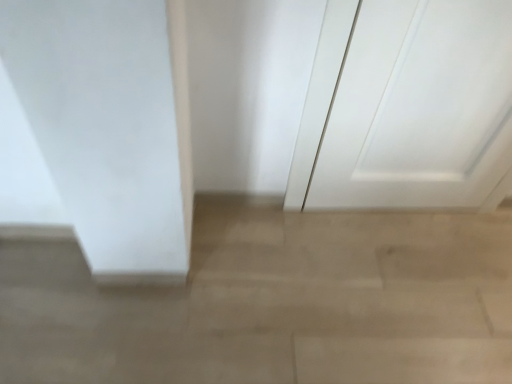
Locate an element on the screen. This screenshot has width=512, height=384. white matte door at upper right is located at coordinates (407, 108).

What is the approximate height of white matte door at upper right?

white matte door at upper right is 87.84 centimeters tall.

Image resolution: width=512 pixels, height=384 pixels. Describe the element at coordinates (407, 108) in the screenshot. I see `white matte door at upper right` at that location.

Measure the distance between point (x=465, y=59) and camera.

They are 3.83 feet apart.

Locate an element on the screen. The image size is (512, 384). beige polished concrete at center is located at coordinates (274, 303).

This screenshot has height=384, width=512. What do you see at coordinates (274, 303) in the screenshot? I see `beige polished concrete at center` at bounding box center [274, 303].

In order to face beige polished concrete at center, should I rotate leftwards or rightwards?

Rotate right and turn 3.990 degrees.

Image resolution: width=512 pixels, height=384 pixels. Identify the location of white matte door at upper right. (407, 108).

Is beige polished concrete at center to the left of white matte door at upper right from the viewer's perspective?

Yes.

Is beige polished concrete at center in front of or behind white matte door at upper right in the image?

beige polished concrete at center is behind white matte door at upper right.

Does point (61, 248) appear closer or farther from the camera than point (407, 159)?

Point (61, 248) appears to be closer to the viewer than point (407, 159).

From the image's perspective, is beige polished concrete at center on top of white matte door at upper right?

No.

From a real-world perspective, which object rests below the other?

beige polished concrete at center is physically lower.

Is beige polished concrete at center wider or thinner than white matte door at upper right?

In the image, beige polished concrete at center appears to be wider than white matte door at upper right.

Looking at this image, is beige polished concrete at center taller or shorter than white matte door at upper right?

beige polished concrete at center is shorter than white matte door at upper right.

Does beige polished concrete at center have a smaller size compared to white matte door at upper right?

No, beige polished concrete at center is not smaller than white matte door at upper right.

In the scene shown: Which is correct: beige polished concrete at center is inside white matte door at upper right, or outside of it?

beige polished concrete at center is not enclosed by white matte door at upper right.

Is beige polished concrete at center directly adjacent to white matte door at upper right?

No, beige polished concrete at center is not next to white matte door at upper right.

Is beige polished concrete at center aimed at white matte door at upper right?

No.

Based on the photo, what's the angular difference between beige polished concrete at center and white matte door at upper right's facing directions?

They differ by 91.4 degrees in their facing directions.

At what (x,y) coordinates should I click in order to perform the action: click on concrete that appears below the white matte door at upper right (from a real-world perspective). Please return your answer as a coordinate pair (x, y). This screenshot has height=384, width=512. Looking at the image, I should click on (274, 303).

Does white matte door at upper right appear on the left side of beige polished concrete at center?

No, white matte door at upper right is not to the left of beige polished concrete at center.

Is white matte door at upper right further to camera compared to beige polished concrete at center?

No, the depth of white matte door at upper right is less than that of beige polished concrete at center.

Does point (485, 127) come farther from viewer compared to point (126, 298)?

Yes, it is behind point (126, 298).

From the image's perspective, would you say white matte door at upper right is shown under beige polished concrete at center?

No.

From a real-world perspective, between white matte door at upper right and beige polished concrete at center, who is vertically higher?

white matte door at upper right, from a real-world perspective.

Which of these two, white matte door at upper right or beige polished concrete at center, is thinner?

Thinner between the two is white matte door at upper right.

Who is taller, white matte door at upper right or beige polished concrete at center?

A: white matte door at upper right is taller.

Is white matte door at upper right smaller than beige polished concrete at center?

Yes, white matte door at upper right is smaller than beige polished concrete at center.

From the picture: Would you say white matte door at upper right is outside beige polished concrete at center?

Yes, white matte door at upper right is outside of beige polished concrete at center.

Does white matte door at upper right touch beige polished concrete at center?

No, white matte door at upper right is not beside beige polished concrete at center.

Is white matte door at upper right oriented towards beige polished concrete at center?

No, white matte door at upper right is not turned towards beige polished concrete at center.

What's the angular difference between white matte door at upper right and beige polished concrete at center's facing directions?

The angular difference between white matte door at upper right and beige polished concrete at center is 91.4 degrees.

Locate an element on the screen. door in front of the beige polished concrete at center is located at coordinates (407, 108).

The height and width of the screenshot is (384, 512). What are the coordinates of `concrete on the left of white matte door at upper right` in the screenshot? It's located at (274, 303).

Image resolution: width=512 pixels, height=384 pixels. What are the coordinates of `concrete below the white matte door at upper right (from the image's perspective)` in the screenshot? It's located at (274, 303).